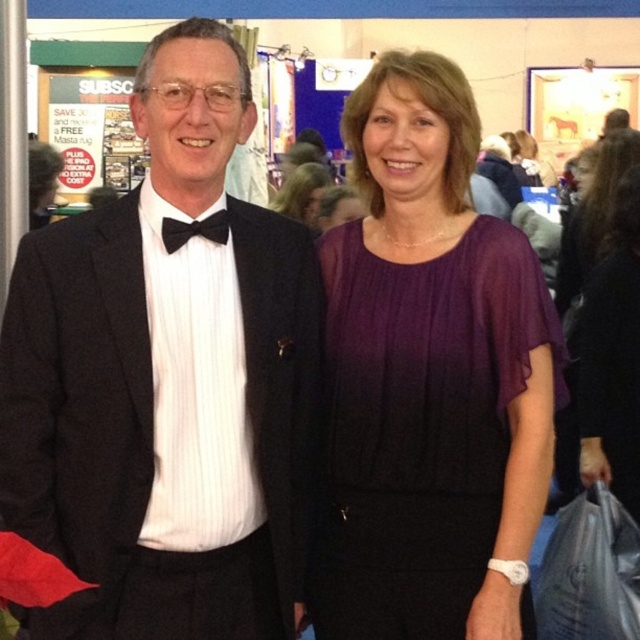
You are a photographer at a formal event and need to ensure that two key elements in your composition are balanced. You have the purple satin dress at center and the black satin bow tie at center in your frame. Given their widths, which element should you adjust to maintain symmetry?

The purple satin dress at center is wider than the black satin bow tie at center. To maintain symmetry, you should adjust the position of the purple satin dress at center to align with the narrower black satin bow tie at center.

You are a photographer at a formal event and need to adjust the lighting to highlight both the black satin suit at center and the black satin bow tie at center. Since the objects have different heights, which one should you focus on first to ensure proper exposure?

The black satin suit at center is taller than the black satin bow tie at center, so you should focus on the black satin suit at center first to ensure proper exposure for the taller object before adjusting for the shorter one.

You are a photographer who needs to adjust the lighting to focus on the purple satin dress at center. Based on its position, which coordinate should you aim the spotlight at?

The purple satin dress at center is positioned at coordinate point (301, 193), so the photographer should aim the spotlight at that exact coordinate to focus on it.